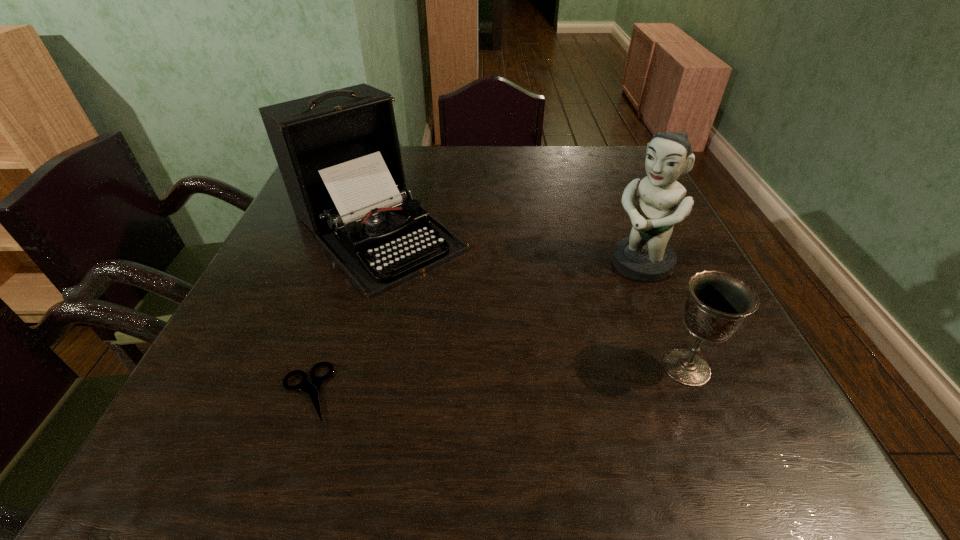
Locate an element on the screen. object that is at the near left corner is located at coordinates (312, 389).

Find the location of a particular element. object that is at the near right corner is located at coordinates (717, 305).

Image resolution: width=960 pixels, height=540 pixels. In the image, there is a desktop. What are the coordinates of `vacant space at the far edge` in the screenshot? It's located at (568, 148).

In the image, there is a desktop. Where is `free region at the near edge`? The width and height of the screenshot is (960, 540). free region at the near edge is located at coordinates (645, 394).

What are the coordinates of `free space at the left edge` in the screenshot? It's located at (290, 262).

The image size is (960, 540). In the image, there is a desktop. Find the location of `free space at the right edge`. free space at the right edge is located at coordinates (665, 281).

Image resolution: width=960 pixels, height=540 pixels. Find the location of `vacant space at the far right corner of the desktop`. vacant space at the far right corner of the desktop is located at coordinates (640, 164).

You are a GUI agent. You are given a task and a screenshot of the screen. Output one action in this format:
    pyautogui.click(x=<x>, y=<y>)
    Task: Click on the unoccupied position between the figurine and the second shortest object
    
    Given the screenshot: What is the action you would take?
    click(x=663, y=315)

The height and width of the screenshot is (540, 960). Find the location of `free space between the typewriter and the shortest object`. free space between the typewriter and the shortest object is located at coordinates (341, 310).

Where is `empty location between the chalice and the typewriter`? The image size is (960, 540). empty location between the chalice and the typewriter is located at coordinates (531, 298).